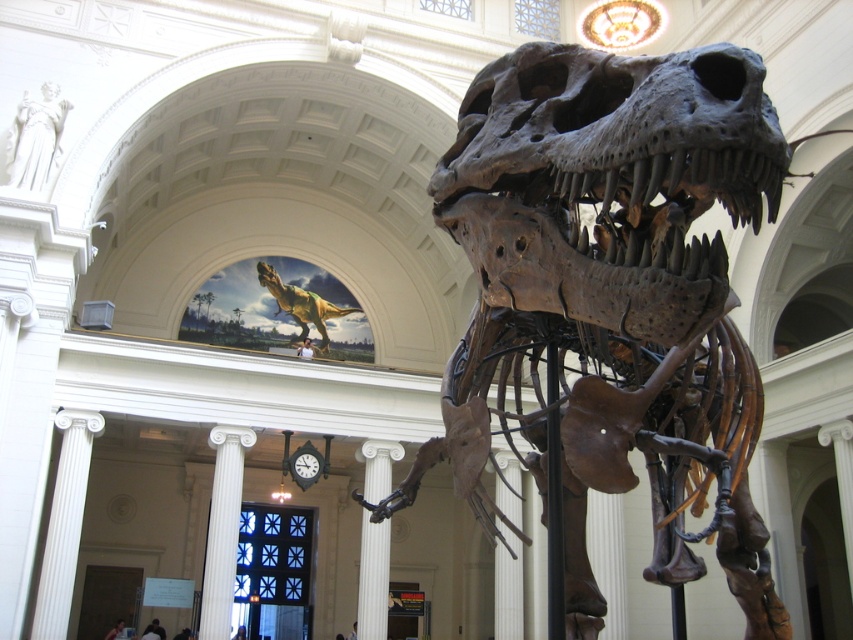
Question: Considering the relative positions of white marble column at center and green textured dinosaur at upper center in the image provided, where is white marble column at center located with respect to green textured dinosaur at upper center?

Choices:
 (A) below
 (B) above

Answer: (A)

Question: Which point is closer to the camera?

Choices:
 (A) (376, 588)
 (B) (699, 316)
 (C) (271, 275)

Answer: (B)

Question: Is brown metallic skeleton at center wider than white marble pillar at center?

Choices:
 (A) yes
 (B) no

Answer: (A)

Question: Among these objects, which one is nearest to the camera?

Choices:
 (A) brown metallic skeleton at center
 (B) green textured dinosaur at upper center

Answer: (A)

Question: Which object is positioned closest to the green textured dinosaur at upper center?

Choices:
 (A) white marble column at center
 (B) white marble pillar at center
 (C) brown metallic skeleton at center

Answer: (B)

Question: Is the position of white marble pillar at center less distant than that of green textured dinosaur at upper center?

Choices:
 (A) no
 (B) yes

Answer: (B)